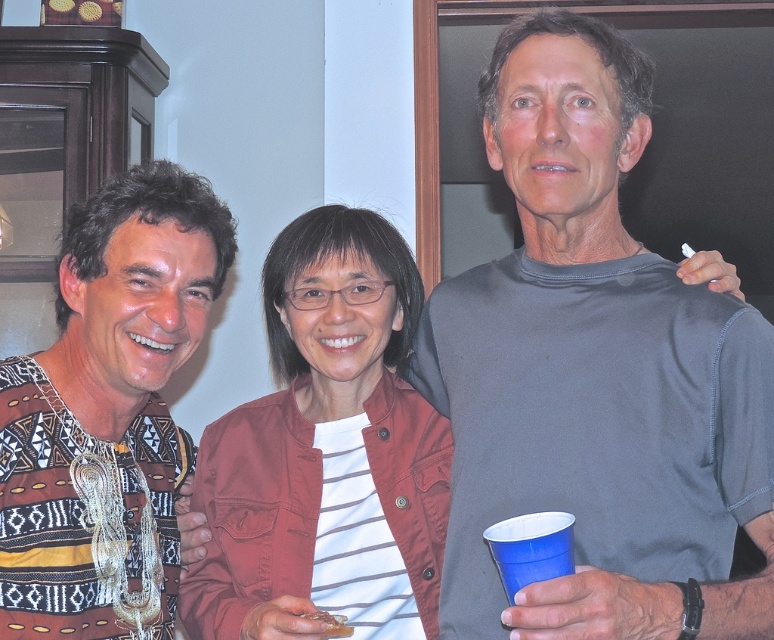
You are at a party and need to grab a drink. You see the denim jacket at center and the blue plastic cup at lower right. Which one is closer to the floor?

The blue plastic cup at lower right is closer to the floor because the denim jacket at center is above it.